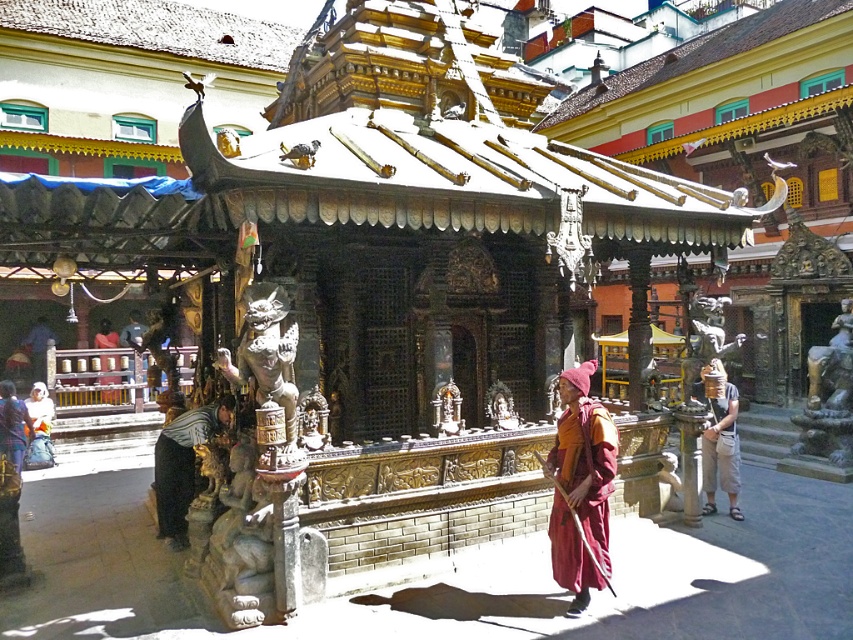
You are standing at the center of the temple looking towards the entrance. Where would you see the tan fabric hat at right relative to your position?

The tan fabric hat at right is located at the right side of the temple, so when standing at the center facing the entrance, the hat would be to your right side.

You are standing at the entrance of the temple and want to reach the point marked at coordinates point (735, 508). Given that your average walking speed is 3 feet per second, how many seconds will it take you to reach that point?

The point (735, 508) is 33.14 feet away from the viewer. At a walking speed of 3 feet per second, it will take approximately 11 seconds to reach that point.